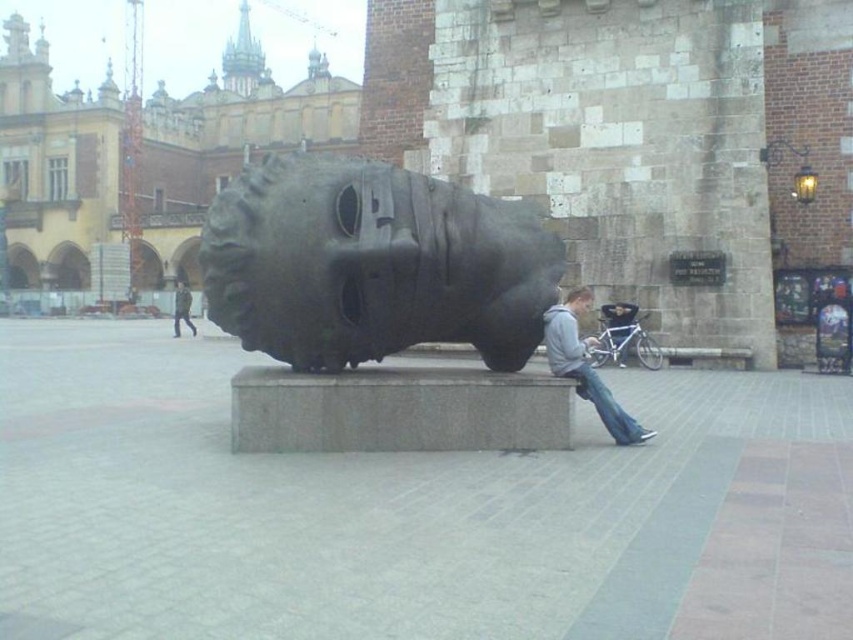
You are a photographer standing in the urban square and want to capture a photo of the dark gray metallic sculpture at center without the blue denim jeans at lower center appearing in the frame. How should you adjust your camera angle?

To avoid capturing the blue denim jeans at lower center, you should angle your camera upwards so that the dark gray metallic sculpture at center fills the frame while the jeans remain out of sight below the sculpture.

You are an artist planning to photograph the gray hoodie at center and the dark gray metallic sculpture at center. Which object should you focus on first if you want to capture the thinner one in your shot?

The gray hoodie at center is thinner than the dark gray metallic sculpture at center, so you should focus on the gray hoodie at center first to capture the thinner one.

You are standing in the urban square and want to take a photo of the gray hoodie at center and the dark gray metallic sculpture at center. Which object should you focus on first if you want to include both in your shot without moving the camera?

The gray hoodie at center is below the dark gray metallic sculpture at center, so you should focus on the dark gray metallic sculpture at center first to ensure both are in the frame.